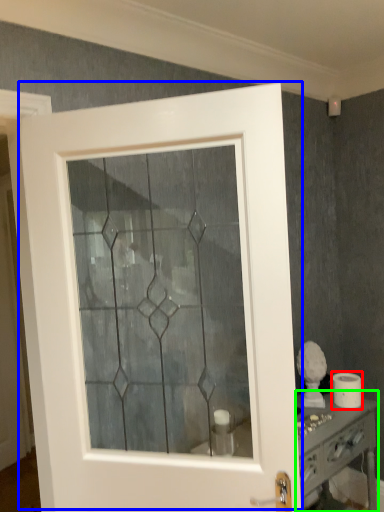
Question: Based on their relative distances, which object is farther from toilet paper (highlighted by a red box)? Choose from door (highlighted by a blue box) and vanity (highlighted by a green box).

Choices:
 (A) door
 (B) vanity

Answer: (A)